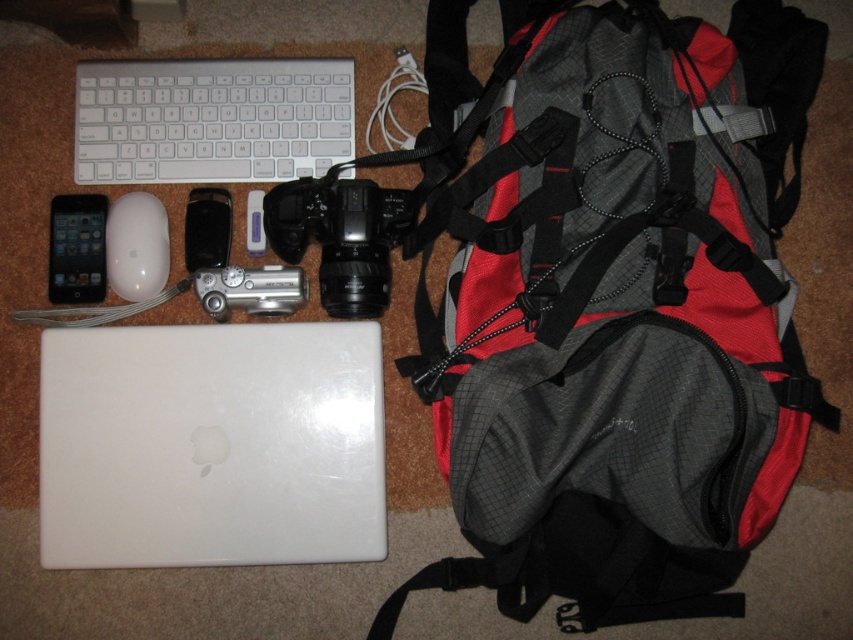
Question: Which point is farther to the camera?

Choices:
 (A) tap(48, 532)
 (B) tap(97, 244)

Answer: (B)

Question: Does silver metallic digital camera at center appear on the left side of black matte ipod at upper left?

Choices:
 (A) yes
 (B) no

Answer: (B)

Question: Which of the following is the closest to the observer?

Choices:
 (A) (347, 92)
 (B) (376, 218)

Answer: (B)

Question: Can you confirm if white matte laptop at center is positioned below white matte mouse at upper left?

Choices:
 (A) no
 (B) yes

Answer: (B)

Question: Is white matte laptop at center to the left of matte black phone at left from the viewer's perspective?

Choices:
 (A) yes
 (B) no

Answer: (B)

Question: Which of the following is the closest to the observer?

Choices:
 (A) white matte mouse at upper left
 (B) satin silver camera at upper center
 (C) silver metallic camera at center

Answer: (C)